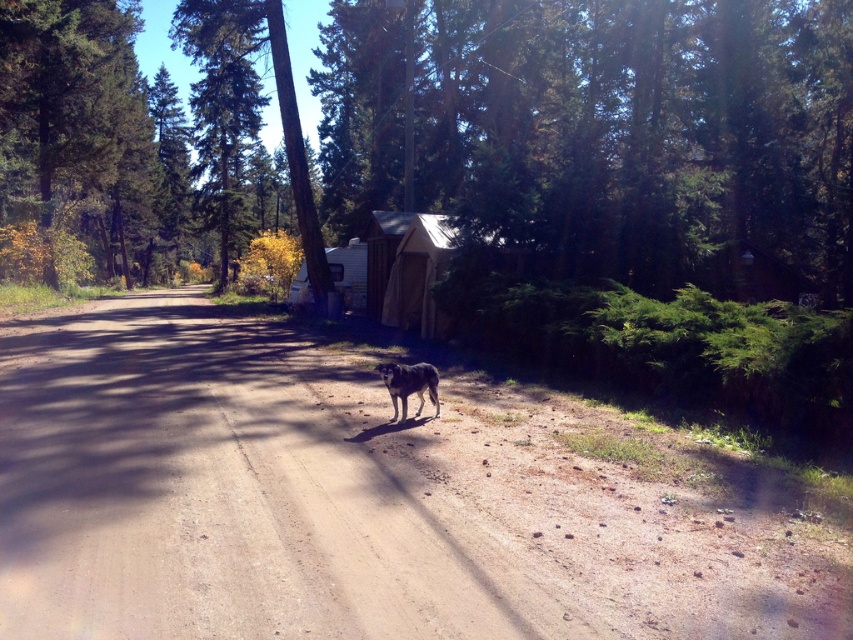
Question: In this image, where is brown dirt track at center located relative to green leafy tree at center?

Choices:
 (A) left
 (B) right

Answer: (B)

Question: Based on their relative distances, which object is nearer to the white canvas cabin at center?

Choices:
 (A) fuzzy brown dog at center
 (B) green leafy tree at center
 (C) wooden cabin at center
 (D) brown dirt track at center

Answer: (C)

Question: Based on their relative distances, which object is farther from the green leafy tree at center?

Choices:
 (A) brown dirt track at center
 (B) white canvas cabin at center
 (C) fuzzy brown dog at center
 (D) wooden cabin at center

Answer: (C)

Question: Which point is farther to the camera?

Choices:
 (A) green leafy tree at center
 (B) white canvas cabin at center

Answer: (B)

Question: Is brown dirt track at center smaller than fuzzy brown dog at center?

Choices:
 (A) no
 (B) yes

Answer: (A)

Question: Where is green leafy tree at center located in relation to fuzzy brown dog at center in the image?

Choices:
 (A) above
 (B) below

Answer: (A)